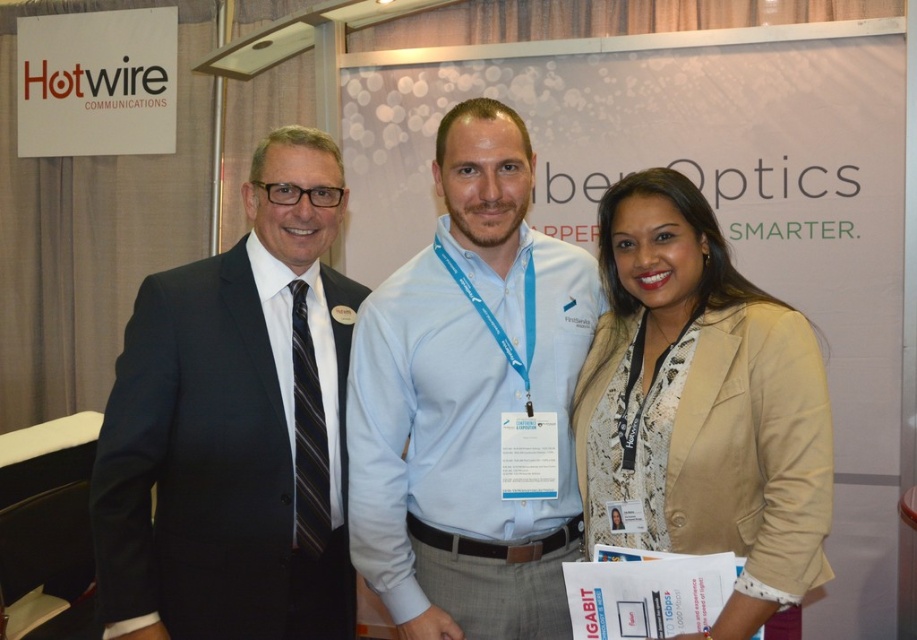
You are an event organizer who needs to adjust the stage setup. You want to ensure that the light blue jersey at center is visible to the audience. Should you move the white paperboard at center forward or backward?

The light blue jersey at center is currently behind the white paperboard at center. To make the light blue jersey at center visible, you should move the white paperboard at center backward or remove it so the light blue jersey at center is no longer obstructed.

You are organizing a group photo and need to arrange the black suit at left and the light blue jersey at center in the order they appear from left to right. What is the correct sequence?

The correct sequence from left to right is black suit at left followed by light blue jersey at center because the black suit at left is positioned on the left side of light blue jersey at center.